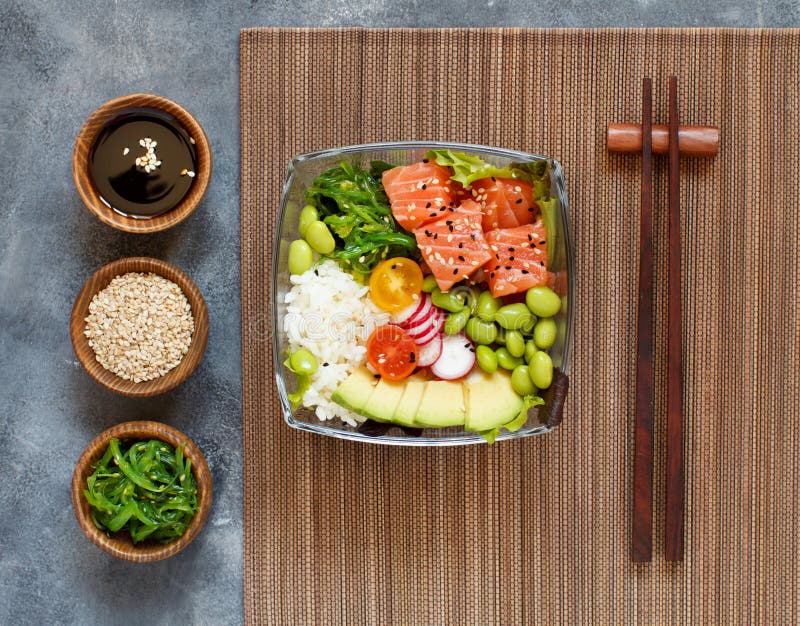
Where is `mat`? mat is located at coordinates (326, 548).